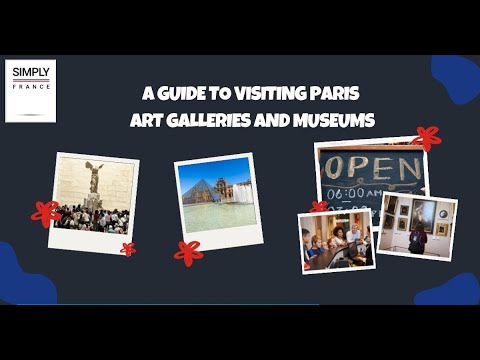
Where is `polaroid photos`? polaroid photos is located at coordinates 104,248, 237,235.